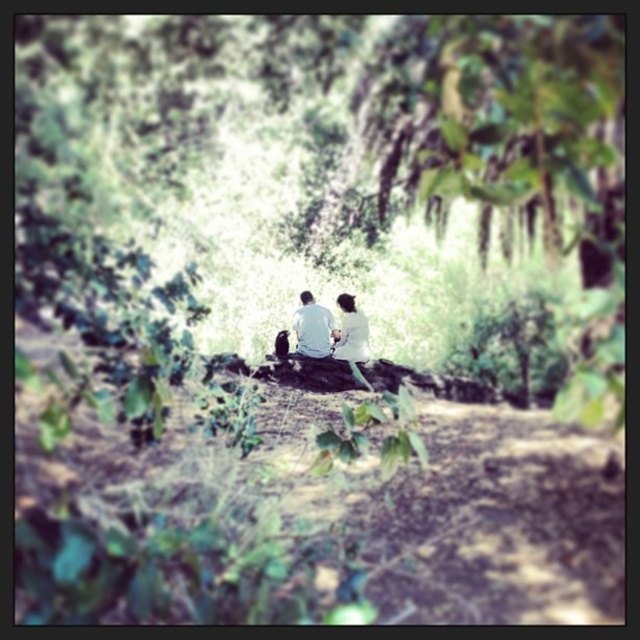
Question: Which of the following is the farthest from the observer?

Choices:
 (A) (321, 337)
 (B) (340, 296)

Answer: (B)

Question: Which object is closer to the camera taking this photo?

Choices:
 (A) white cotton shirt at center
 (B) white matte shirt at center

Answer: (B)

Question: Can you confirm if white cotton shirt at center is bigger than white matte shirt at center?

Choices:
 (A) no
 (B) yes

Answer: (B)

Question: Is white cotton shirt at center to the left of white matte shirt at center from the viewer's perspective?

Choices:
 (A) yes
 (B) no

Answer: (A)

Question: Which point appears farthest from the camera in this image?

Choices:
 (A) (314, 342)
 (B) (340, 337)

Answer: (B)

Question: Does white cotton shirt at center appear on the right side of white matte shirt at center?

Choices:
 (A) yes
 (B) no

Answer: (B)